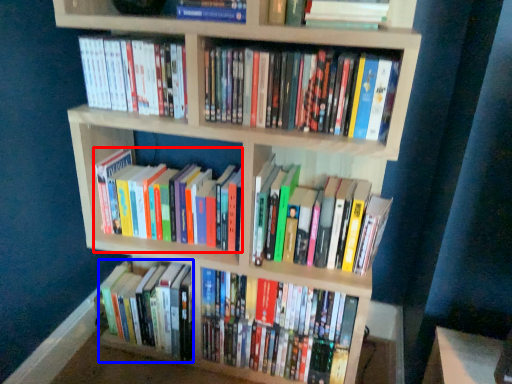
Question: Which of the following is the closest to the observer, book (highlighted by a red box) or book (highlighted by a blue box)?

Choices:
 (A) book
 (B) book

Answer: (A)